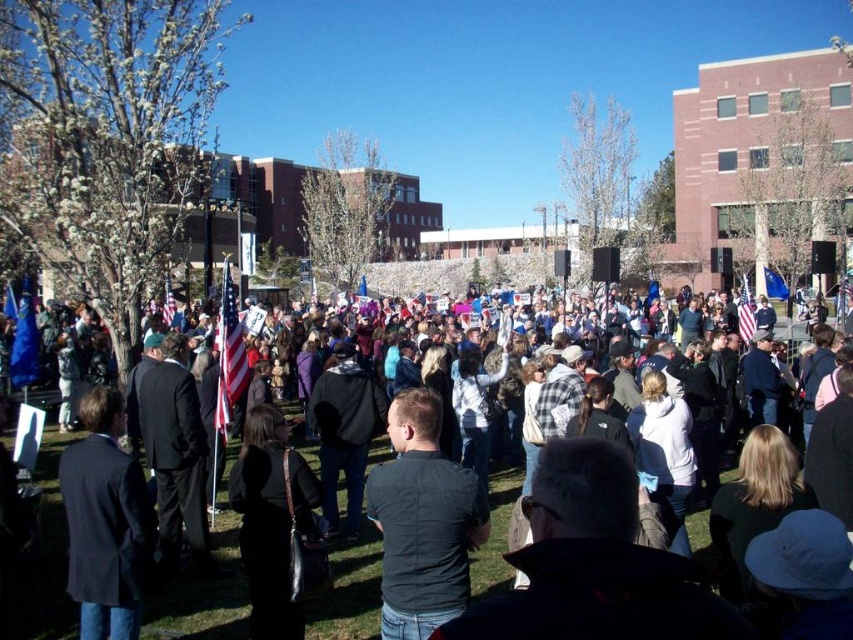
You are a photographer at the event and want to capture both the white cotton shirt at center and the dark gray fabric shirt at center in the same frame. Which shirt should you focus on to ensure both are in focus without adjusting your camera settings?

The white cotton shirt at center has a larger size compared to the dark gray fabric shirt at center, so focusing on the larger white cotton shirt at center will help keep both shirts in focus since it is closer to the camera.

You are at an outdoor event and notice two shirts at the center of the crowd. The white cotton shirt at center and the dark gray fabric shirt at center. Which shirt is covering part of the other?

The white cotton shirt at center is positioned over dark gray fabric shirt at center, so it is covering part of it.